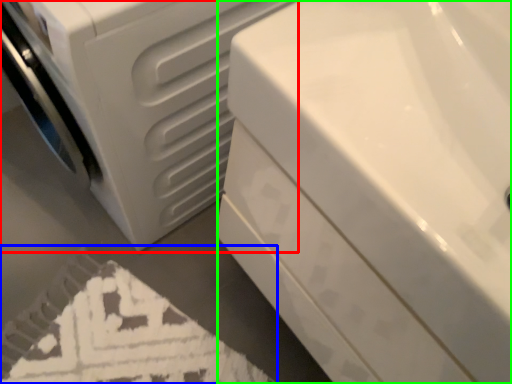
Question: Considering the real-world distances, which object is farthest from washing machine (highlighted by a red box)? bath mat (highlighted by a blue box) or bath (highlighted by a green box)?

Choices:
 (A) bath mat
 (B) bath

Answer: (A)